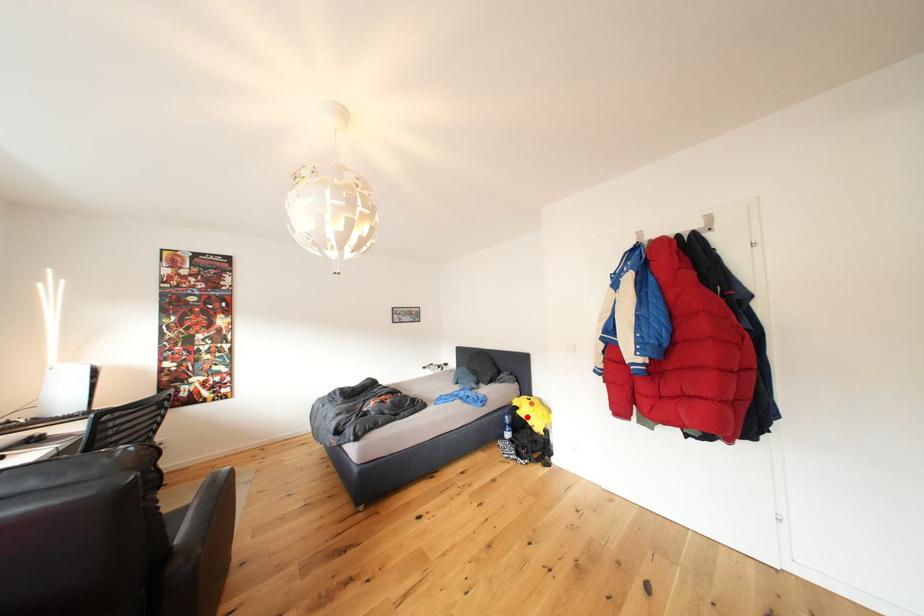
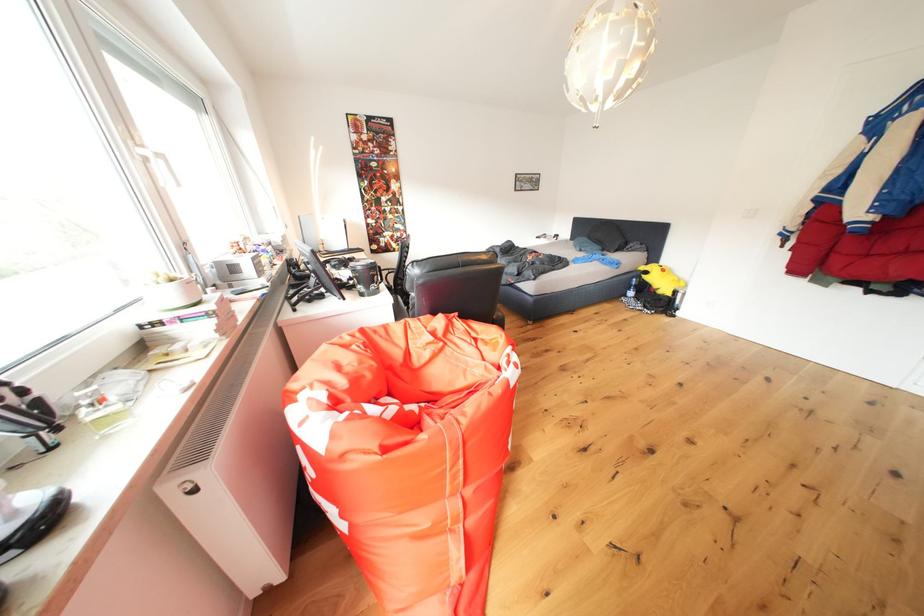
Question: I am providing you with two images of the same scene from different viewpoints. A red point is shown in image1. For the corresponding object point in image2, is it positioned nearer or farther from the camera?

Choices:
 (A) Nearer
 (B) Farther

Answer: (A)